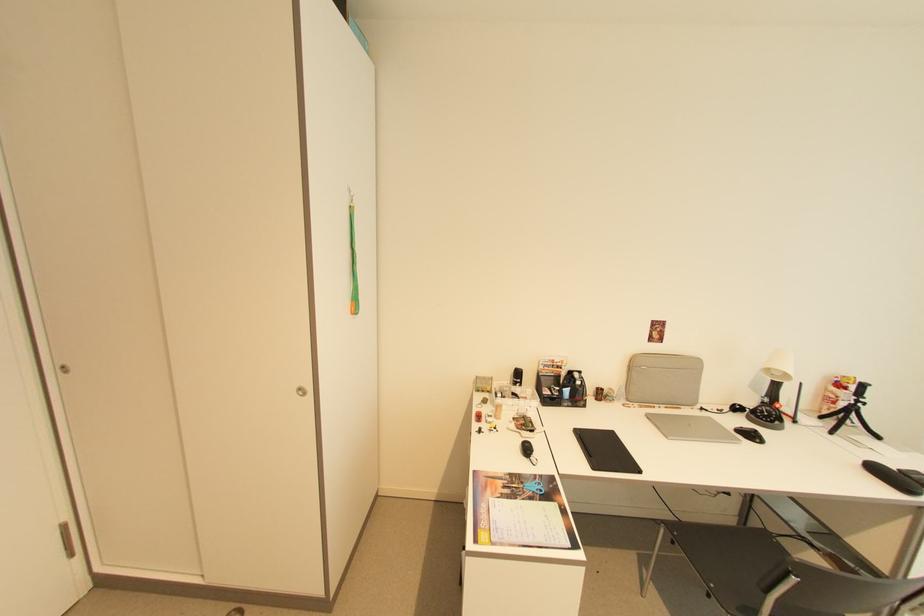
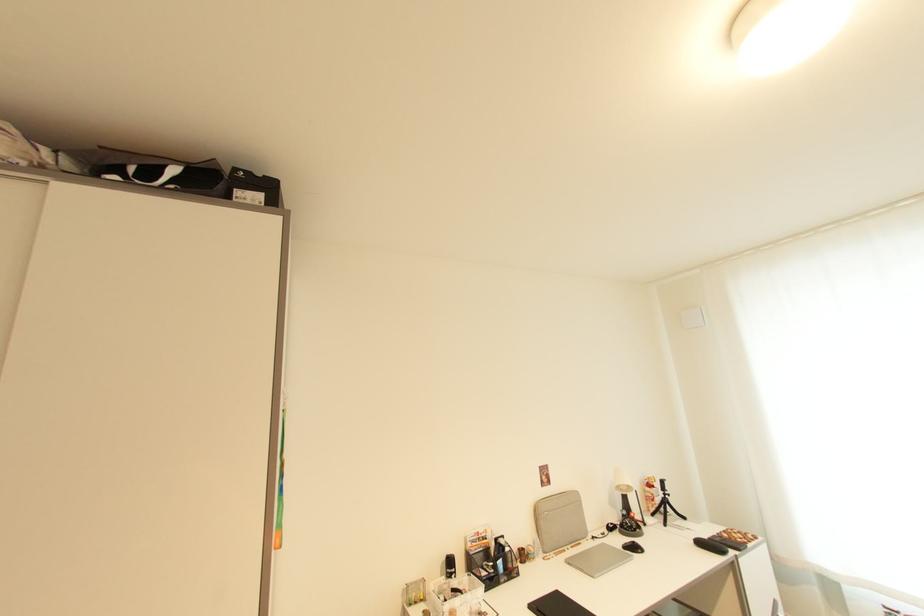
Locate, in the second image, the point that corresponds to the point at 756,437 in the first image.

(639, 549)